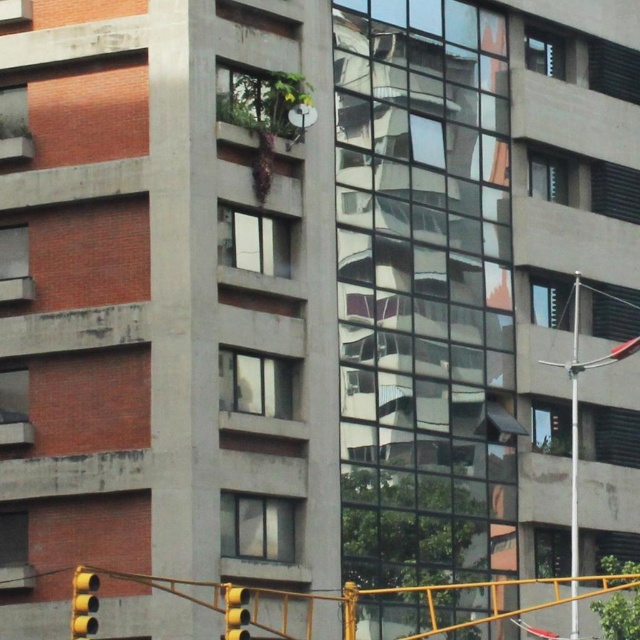
Does point (573, 404) come in front of point (236, 593)?

No, it is behind (236, 593).

How distant is metallic pole at right from yellow matte traffic light at lower center?

metallic pole at right is 16.88 meters from yellow matte traffic light at lower center.

What are the coordinates of `metallic pole at right` in the screenshot? It's located at (573, 454).

The image size is (640, 640). I want to click on metallic pole at right, so click(x=573, y=454).

Is metallic pole at right bigger than yellow matte traffic light at lower left?

Yes.

Is metallic pole at right positioned in front of yellow matte traffic light at lower left?

No.

Who is more forward, (570, 586) or (81, 625)?

Point (81, 625) is in front.

Image resolution: width=640 pixels, height=640 pixels. I want to click on metallic pole at right, so click(x=573, y=454).

Between yellow matte traffic light at lower left and yellow matte traffic light at lower center, which one has more height?

With more height is yellow matte traffic light at lower center.

Can you confirm if yellow matte traffic light at lower left is shorter than yellow matte traffic light at lower center?

Yes, yellow matte traffic light at lower left is shorter than yellow matte traffic light at lower center.

Find the location of a particular element. The width and height of the screenshot is (640, 640). yellow matte traffic light at lower left is located at coordinates (83, 604).

At what (x,y) coordinates should I click in order to perform the action: click on yellow matte traffic light at lower left. Please return your answer as a coordinate pair (x, y). This screenshot has width=640, height=640. Looking at the image, I should click on (83, 604).